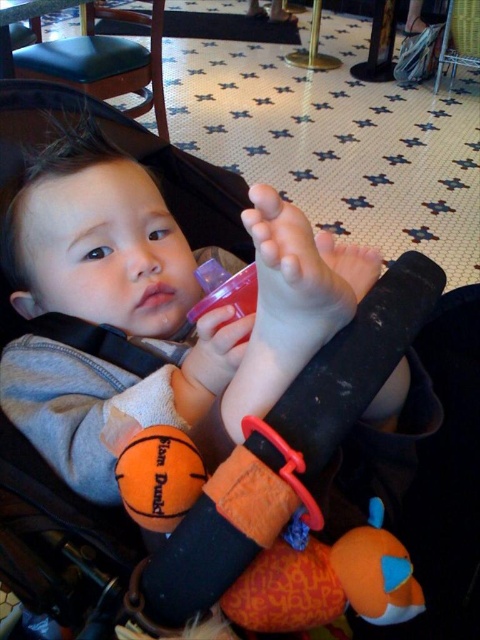
Based on the provided scene description, where is the matte gray baby at center positioned in terms of coordinates?

The matte gray baby at center is located at point (155,307).

You are a parent trying to reach the orange plush toy at center for your child. The matte gray baby at center is in the way. Can you move the baby to access the toy?

The matte gray baby at center is located above the orange plush toy at center, so you can reach the orange plush toy at center by moving downward from the baby.

You are a parent in a restaurant with a stroller. Your child is sitting in the stroller and you notice the matte gray baby at center and the orange plush toy at center. If your child reaches out to grab one of them, which toy can they likely reach without moving their body? Explain your answer based on their positions.

The matte gray baby at center is 10.73 inches away from the orange plush toy at center. Since the distance between them is over 10 inches, the child might not be able to reach both without moving. However, since the question asks which they can likely reach, it depends on which is closer. Wait, but the objects description only states the distance between them, not their positions relative to the child. Hmm, maybe I need to think differently. The problem says the child is at center, and both toys are at the